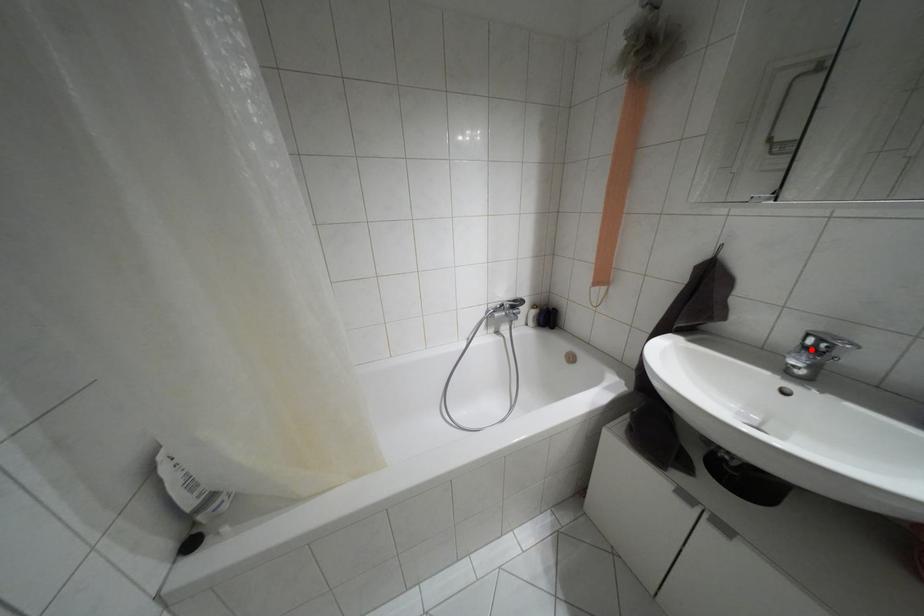
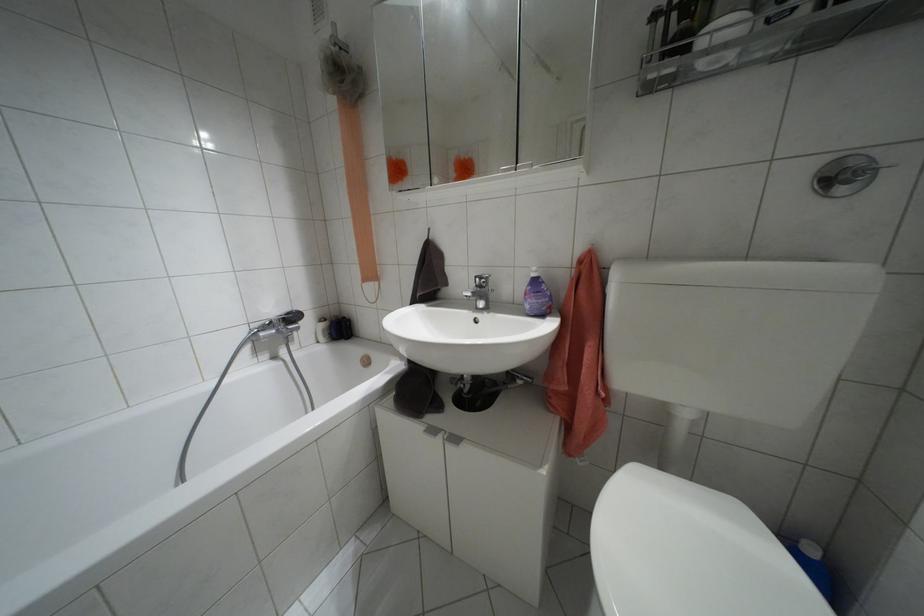
Where in the second image is the point corresponding to the highlighted location from the first image?

(479, 286)